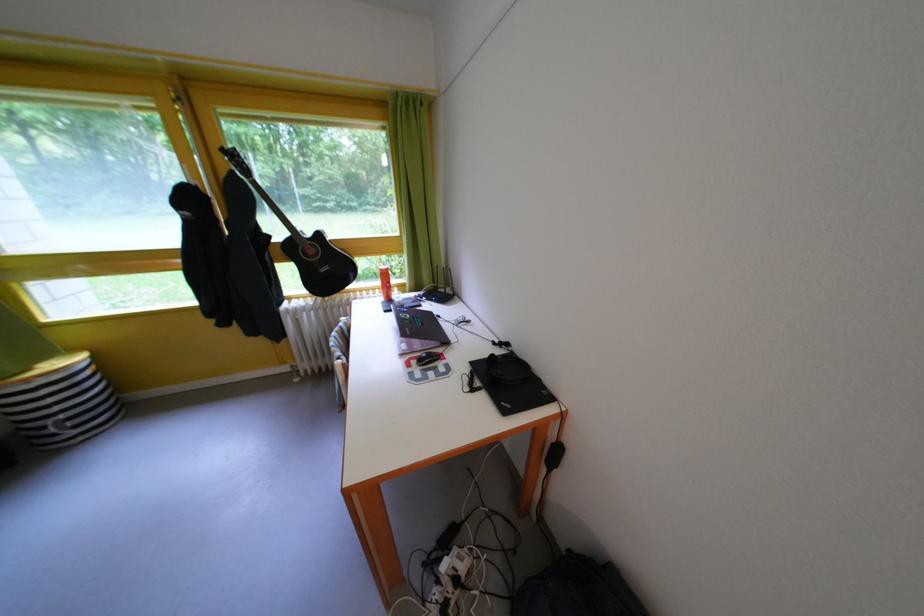
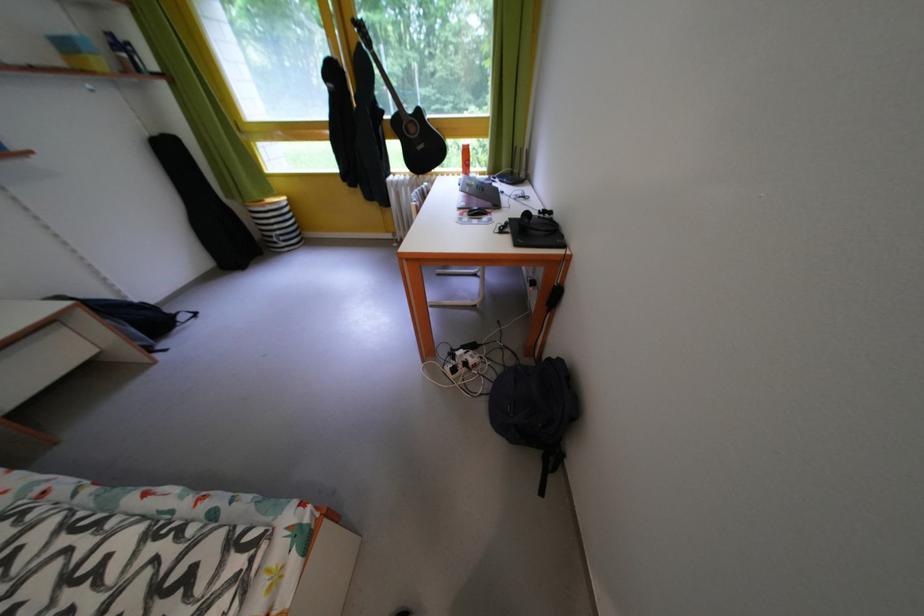
In the second image, find the point that corresponds to (71,423) in the first image.

(287, 238)